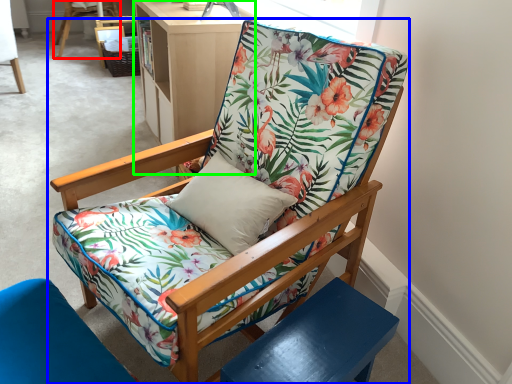
Question: Which is farther away from chair (highlighted by a red box)? chair (highlighted by a blue box) or bookshelf (highlighted by a green box)?

Choices:
 (A) chair
 (B) bookshelf

Answer: (A)